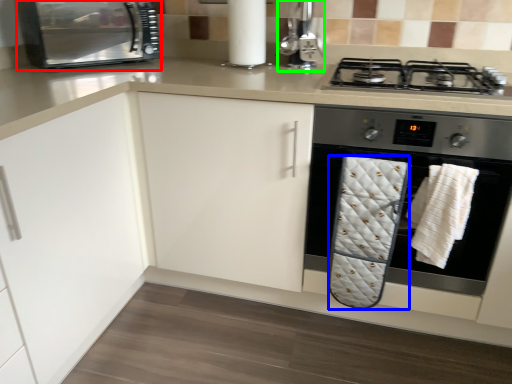
Question: Which object is the farthest from kitchen appliance (highlighted by a red box)? Choose among these: bath towel (highlighted by a blue box) or coffee machine (highlighted by a green box).

Choices:
 (A) bath towel
 (B) coffee machine

Answer: (A)